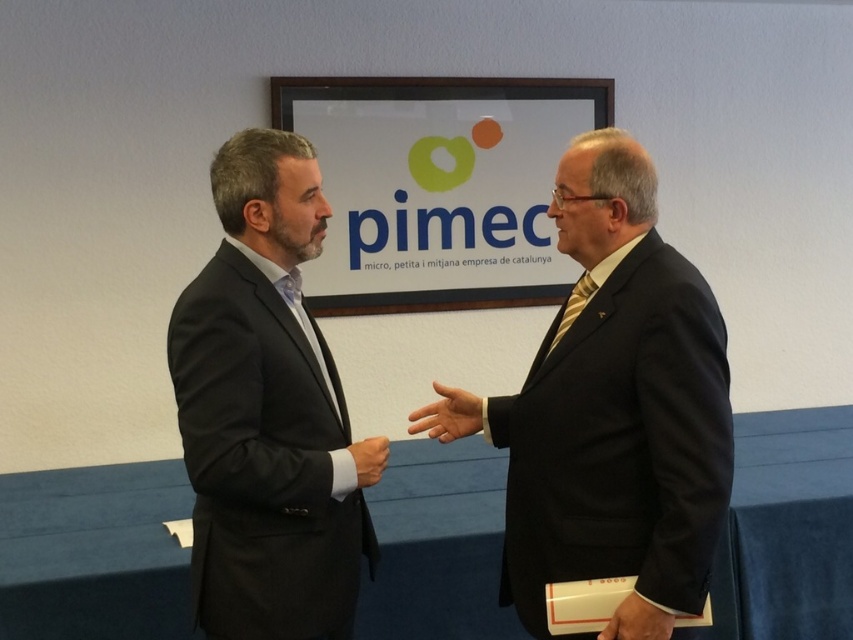
Is matte black suit at center thinner than matte black hand at center?

No, matte black suit at center is not thinner than matte black hand at center.

Is matte black suit at center taller than matte black hand at center?

Yes, matte black suit at center is taller than matte black hand at center.

Is point (590, 314) positioned before point (373, 442)?

Yes.

In order to click on matte black suit at center in this screenshot , I will do [616, 404].

In the scene shown: Does matte black suit at left appear on the right side of smooth leather hand at center?

Incorrect, matte black suit at left is not on the right side of smooth leather hand at center.

Is point (254, 531) positioned in front of point (643, 627)?

No, it is not.

Which is in front, point (248, 237) or point (646, 620)?

Positioned in front is point (646, 620).

This screenshot has width=853, height=640. Find the location of `matte black suit at left`. matte black suit at left is located at coordinates (265, 410).

Is smooth skin hand at center below matte black hand at center?

No, smooth skin hand at center is not below matte black hand at center.

Between point (463, 422) and point (358, 472), which one is positioned in front?

Point (358, 472)

At what (x,y) coordinates should I click in order to perform the action: click on smooth skin hand at center. Please return your answer as a coordinate pair (x, y). Looking at the image, I should click on (447, 413).